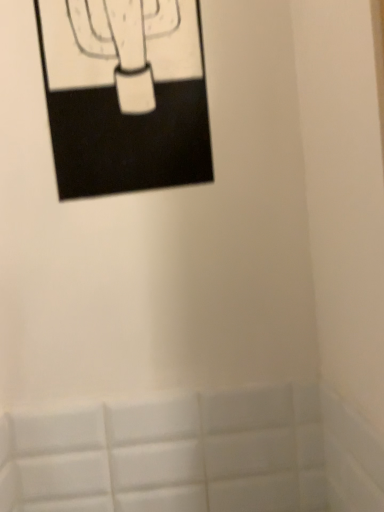
Question: Considering their positions, is white matte tile at lower center located in front of or behind black matte picture frame at upper left?

Choices:
 (A) front
 (B) behind

Answer: (B)

Question: From a real-world perspective, is white matte tile at lower center physically located above or below black matte picture frame at upper left?

Choices:
 (A) above
 (B) below

Answer: (B)

Question: Considering the positions of white matte tile at lower center and black matte picture frame at upper left in the image, is white matte tile at lower center taller or shorter than black matte picture frame at upper left?

Choices:
 (A) short
 (B) tall

Answer: (A)

Question: From a real-world perspective, is black matte picture frame at upper left physically located above or below white matte tile at lower center?

Choices:
 (A) below
 (B) above

Answer: (B)

Question: Looking at their shapes, would you say black matte picture frame at upper left is wider or thinner than white matte tile at lower center?

Choices:
 (A) thin
 (B) wide

Answer: (B)

Question: Would you say black matte picture frame at upper left is to the left or to the right of white matte tile at lower center in the picture?

Choices:
 (A) right
 (B) left

Answer: (B)

Question: From the image's perspective, is black matte picture frame at upper left located above or below white matte tile at lower center?

Choices:
 (A) below
 (B) above

Answer: (B)